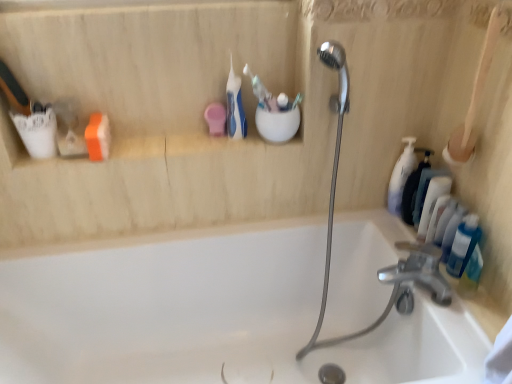
You are a GUI agent. You are given a task and a screenshot of the screen. Output one action in this format:
    pyautogui.click(x=<x>, y=<y>)
    Task: Click on the vacant space that is to the left of white plastic toothbrushes at right, marked as the third toiletry in a right-to-left arrangement
    
    Given the screenshot: What is the action you would take?
    (385, 234)